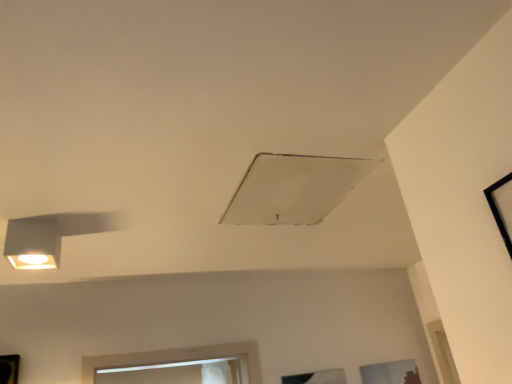
Question: Is white matte exhaust hood at center situated inside transparent glass window at lower right, the third window viewed from the top, or outside?

Choices:
 (A) inside
 (B) outside

Answer: (B)

Question: In terms of height, does white matte exhaust hood at center look taller or shorter compared to transparent glass window at lower right, the 1th window positioned from the bottom?

Choices:
 (A) tall
 (B) short

Answer: (B)

Question: Which object is the farthest from the white matte exhaust hood at center?

Choices:
 (A) black frame at upper right, which is the 1th window in top-to-bottom order
 (B) transparent glass window at lower right, the third window viewed from the top
 (C) transparent glass window at lower center, which is the first window in left-to-right order
 (D) matte white lamp at left

Answer: (B)

Question: Based on their relative distances, which object is nearer to the matte white lamp at left?

Choices:
 (A) black frame at upper right, which is the 3th window in bottom-to-top order
 (B) white matte exhaust hood at center
 (C) transparent glass window at lower center, placed as the second window when sorted from front to back
 (D) transparent glass window at lower right, the third window viewed from the top

Answer: (B)